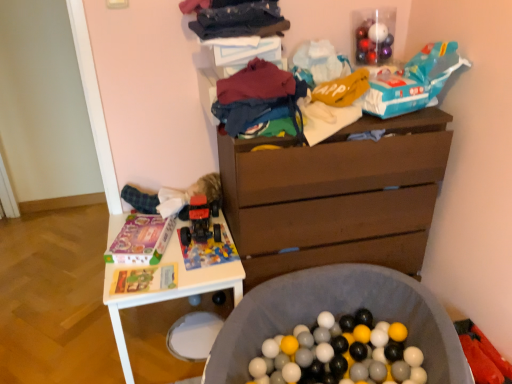
Question: In the image, is teal cardboard box at upper right, the first toy in the top-to-bottom sequence, positioned in front of or behind brown wooden chest of drawers at center?

Choices:
 (A) front
 (B) behind

Answer: (A)

Question: Looking at their shapes, would you say teal cardboard box at upper right, the first toy in the top-to-bottom sequence, is wider or thinner than brown wooden chest of drawers at center?

Choices:
 (A) wide
 (B) thin

Answer: (B)

Question: Estimate the real-world distances between objects in this image. Which object is farther from the rubberized plastic toy car at center, the 2th toy ordered from the bottom?

Choices:
 (A) brown wooden chest of drawers at center
 (B) teal cardboard box at upper right, arranged as the 1th toy when viewed from the right
 (C) brick-patterned plastic toy car at center, the second toy when ordered from left to right
 (D) dark blue fabric at upper center, the first clothing from the top
 (E) multicolored fabric at center, which is counted as the second clothing, starting from the top

Answer: (B)

Question: Which of these objects is positioned closest to the dark blue fabric at upper center, acting as the 2th clothing starting from the bottom?

Choices:
 (A) rubberized plastic toy car at center, positioned as the 1th toy in left-to-right order
 (B) brick-patterned plastic toy car at center, the second toy when ordered from left to right
 (C) multicolored fabric at center, which is counted as the second clothing, starting from the top
 (D) brown wooden chest of drawers at center
 (E) teal cardboard box at upper right, the 3th toy when ordered from bottom to top

Answer: (C)